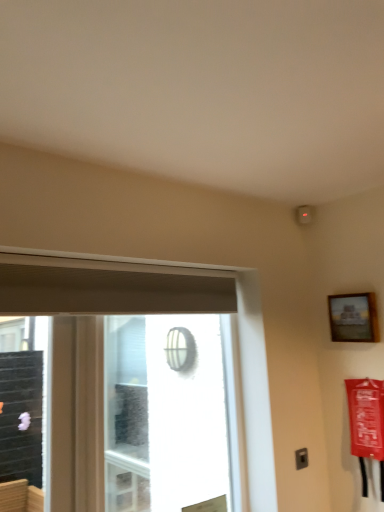
Question: Is transparent glass window at center in front of or behind wooden frame at upper right in the image?

Choices:
 (A) behind
 (B) front

Answer: (B)

Question: Considering the positions of transparent glass window at center and wooden frame at upper right in the image, is transparent glass window at center bigger or smaller than wooden frame at upper right?

Choices:
 (A) small
 (B) big

Answer: (B)

Question: Which of these objects is positioned farthest from the white mesh screen at center?

Choices:
 (A) transparent glass window at center
 (B) wooden frame at upper right

Answer: (B)

Question: Estimate the real-world distances between objects in this image. Which object is farther from the wooden frame at upper right?

Choices:
 (A) white mesh screen at center
 (B) transparent glass window at center

Answer: (A)